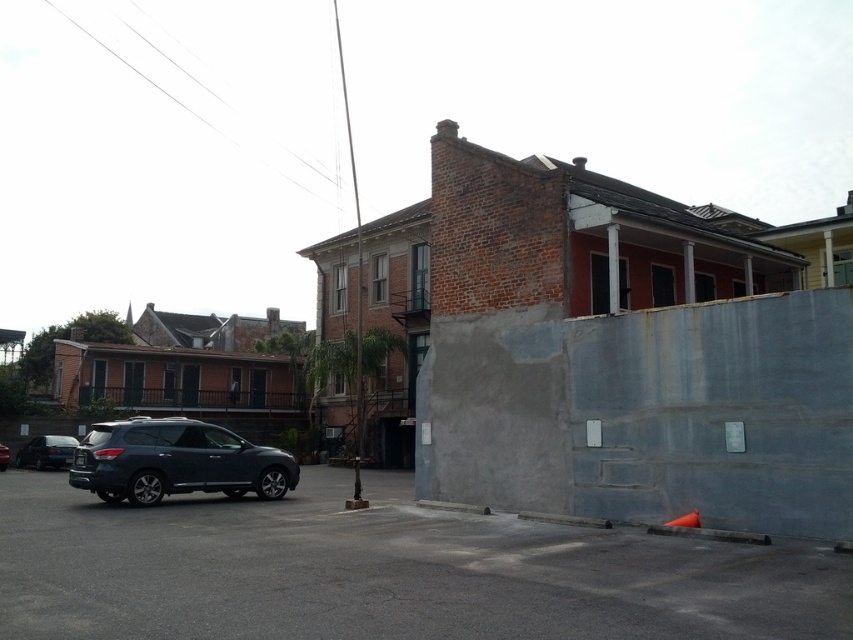
You are a delivery driver who needs to park your vehicle in a tight space. You see a satin black sedan at lower left and a matte black suv at lower left. Which vehicle should you avoid parking next to if you want to leave more space for your delivery van?

The satin black sedan at lower left is bigger than the matte black suv at lower left. Therefore, you should avoid parking next to the satin black sedan at lower left to leave more space for your delivery van.